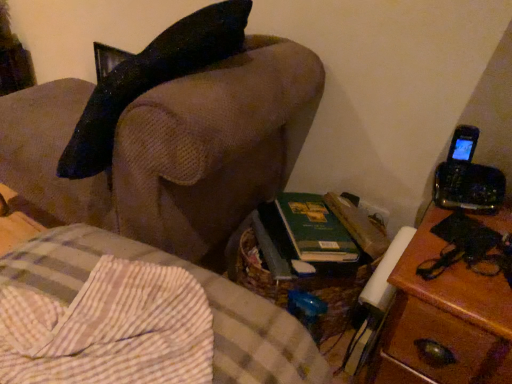
Question: Is point (115, 324) positioned closer to the camera than point (189, 200)?

Choices:
 (A) farther
 (B) closer

Answer: (B)

Question: In terms of size, does brown woven basket at lower center, placed as the 1th furniture when sorted from bottom to top, appear bigger or smaller than brown fabric couch at upper left, the second furniture in the bottom-to-top sequence?

Choices:
 (A) small
 (B) big

Answer: (A)

Question: Based on their relative distances, which object is farther from the wooden nightstand at right?

Choices:
 (A) brown woven basket at lower center, the second furniture from the top
 (B) brown fabric couch at upper left, the 1th furniture positioned from the top

Answer: (B)

Question: Based on their relative distances, which object is farther from the wooden nightstand at right?

Choices:
 (A) brown woven basket at lower center, the second furniture from the top
 (B) brown fabric couch at upper left, the 1th furniture positioned from the top

Answer: (B)